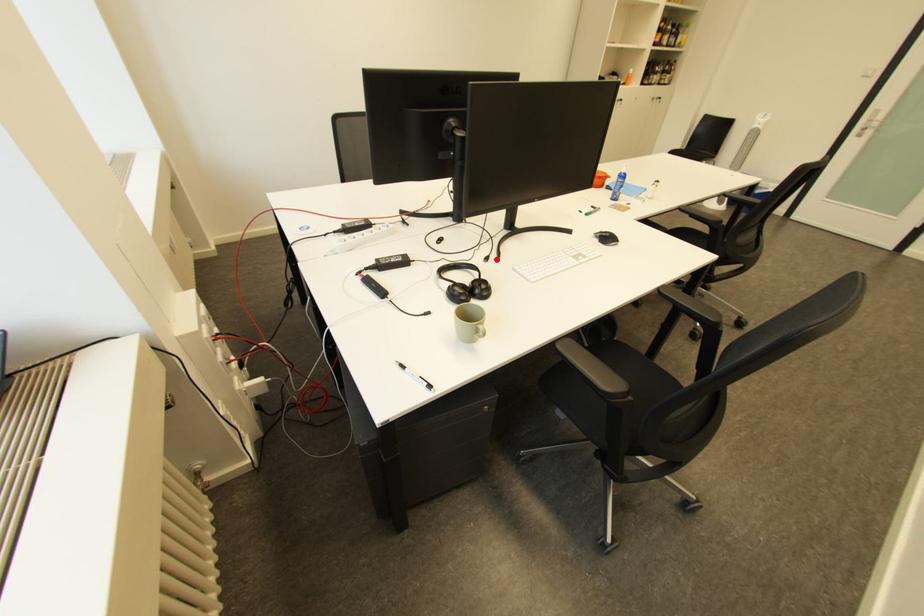
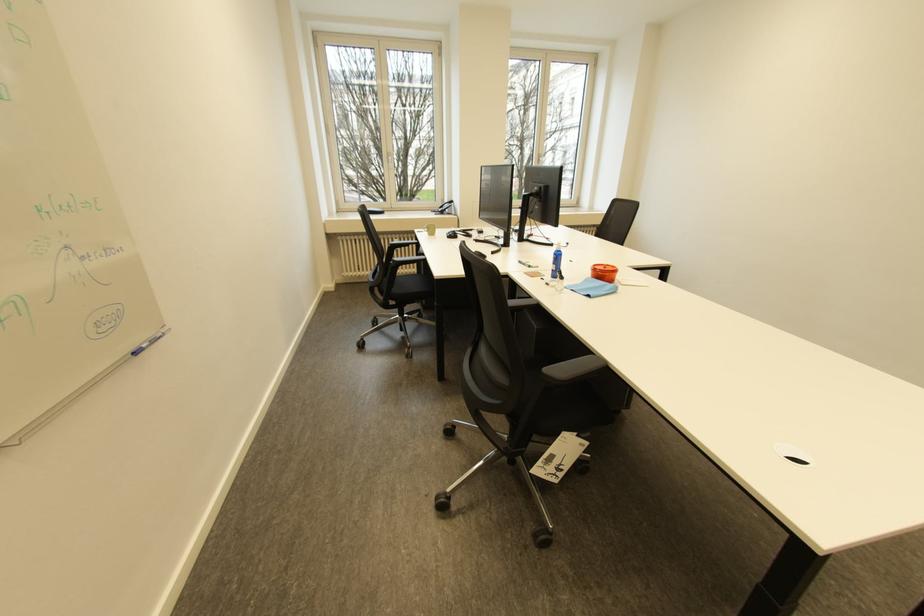
In the second image, find the point that corresponds to the highlighted location in the first image.

(483, 241)